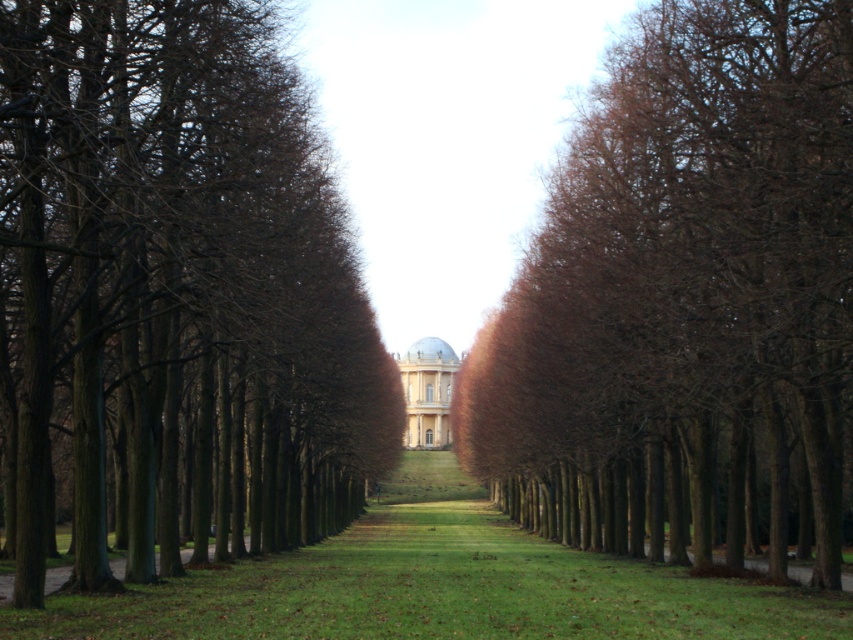
Question: Does green grass at center appear over matte white dome at center?

Choices:
 (A) yes
 (B) no

Answer: (B)

Question: Which point appears farthest from the camera in this image?

Choices:
 (A) (242, 298)
 (B) (427, 458)
 (C) (695, 284)
 (D) (444, 387)

Answer: (D)

Question: Which point is farther to the camera?

Choices:
 (A) matte white dome at center
 (B) green grass at center
 (C) brown smooth tree at center

Answer: (A)

Question: Can you confirm if brown textured tree at left is positioned to the left of green grass at center?

Choices:
 (A) no
 (B) yes

Answer: (B)

Question: Is brown smooth tree at center to the left of matte white dome at center from the viewer's perspective?

Choices:
 (A) yes
 (B) no

Answer: (B)

Question: Which object is positioned closest to the brown textured tree at left?

Choices:
 (A) green grass at center
 (B) brown smooth tree at center
 (C) matte white dome at center

Answer: (A)